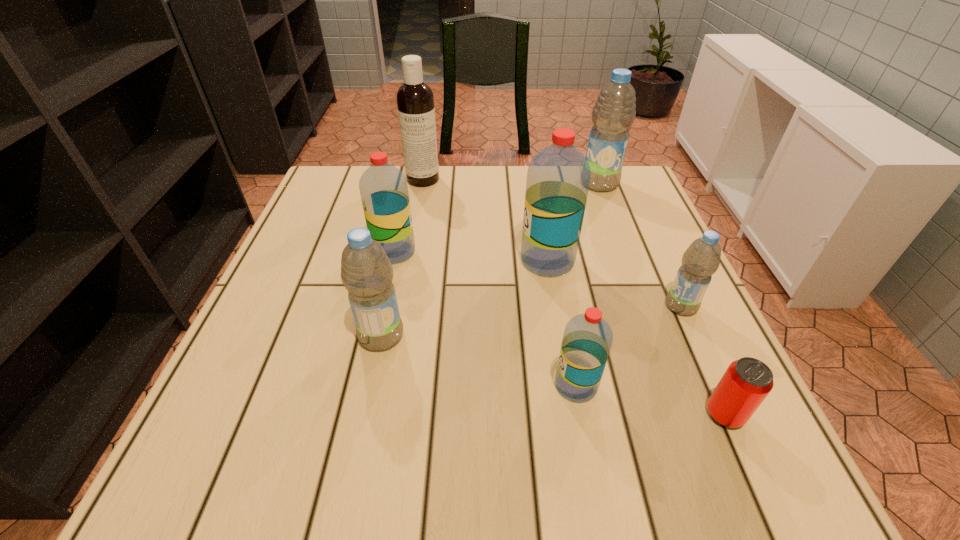
Image resolution: width=960 pixels, height=540 pixels. Find the location of `the smallest red water bottle`. the smallest red water bottle is located at coordinates (587, 339).

At what (x,y) coordinates should I click in order to perform the action: click on the shortest object. Please return your answer as a coordinate pair (x, y). The width and height of the screenshot is (960, 540). Looking at the image, I should click on (747, 381).

The width and height of the screenshot is (960, 540). Find the location of `free space located on the label side of the dishwasher detergent`. free space located on the label side of the dishwasher detergent is located at coordinates (408, 260).

Locate an element on the screen. free space located on the left of the farthest blue water bottle is located at coordinates (529, 184).

Where is `vacant space situated 0.380m on the front label of the biggest red water bottle`? The height and width of the screenshot is (540, 960). vacant space situated 0.380m on the front label of the biggest red water bottle is located at coordinates (349, 260).

Where is `vacant space located on the front label of the biggest red water bottle`? Image resolution: width=960 pixels, height=540 pixels. vacant space located on the front label of the biggest red water bottle is located at coordinates (385, 260).

I want to click on vacant region located 0.400m on the front label of the biggest red water bottle, so click(340, 260).

Identify the location of free space located 0.110m on the back of the sixth farthest object. The width and height of the screenshot is (960, 540). (394, 280).

Image resolution: width=960 pixels, height=540 pixels. What are the coordinates of `free space located on the front label of the leftmost red water bottle` in the screenshot? It's located at (455, 252).

Locate an element on the screen. This screenshot has width=960, height=540. free location located 0.350m on the left of the smallest blue water bottle is located at coordinates (490, 306).